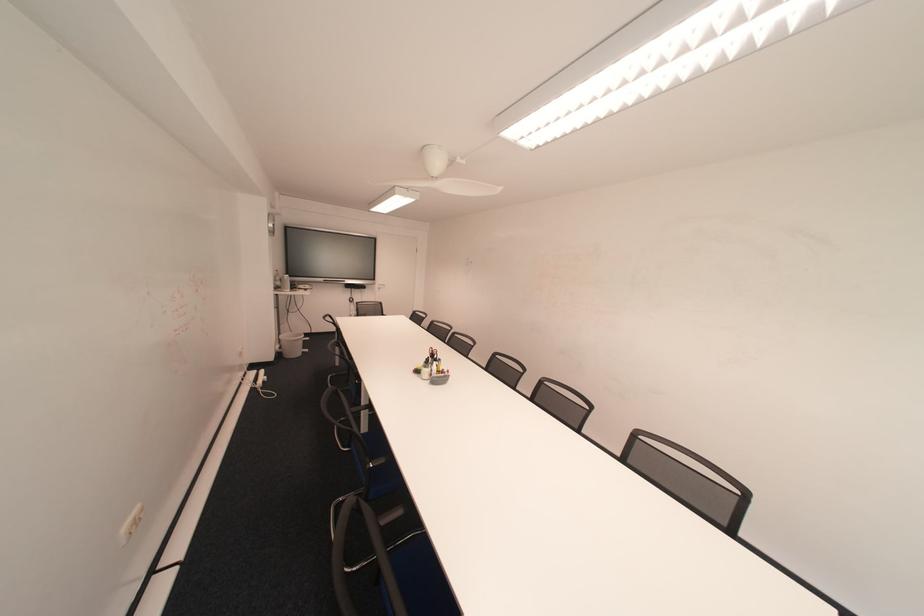
Locate an element on the screen. Image resolution: width=924 pixels, height=616 pixels. white trash can is located at coordinates (290, 344).